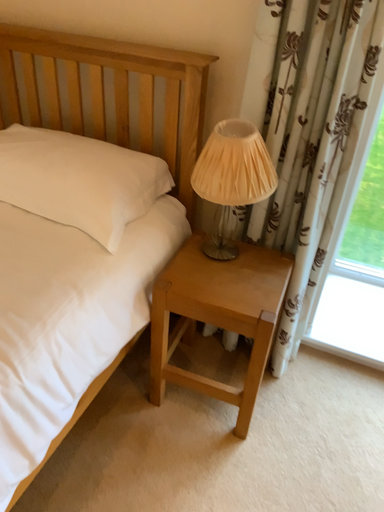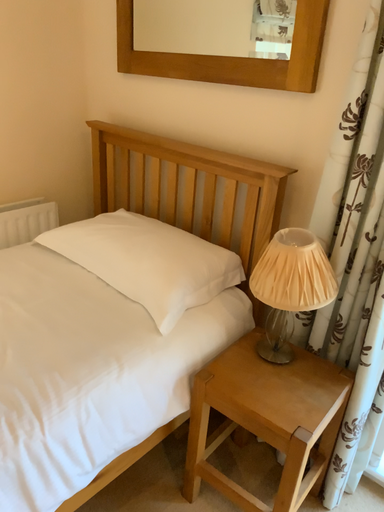
Question: How did the camera likely rotate when shooting the video?

Choices:
 (A) rotated left
 (B) rotated right

Answer: (A)